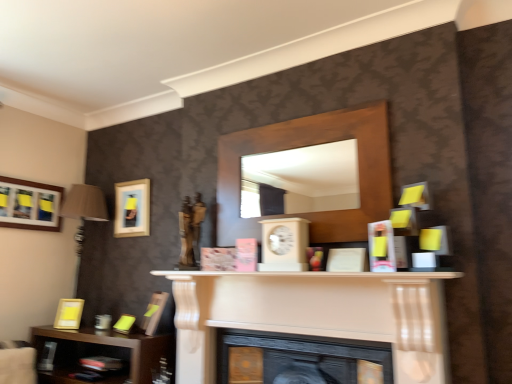
Image resolution: width=512 pixels, height=384 pixels. What do you see at coordinates (154, 312) in the screenshot?
I see `matte gold picture frame at lower left, the 4th picture frame when ordered from left to right` at bounding box center [154, 312].

This screenshot has width=512, height=384. Describe the element at coordinates (306, 146) in the screenshot. I see `wooden mirror at center, which is the 1th shelf from top to bottom` at that location.

In order to face wooden mirror at center, the 1th shelf viewed from the right, should I rotate leftwards or rightwards?

Turn right by 5.217 degrees to look at wooden mirror at center, the 1th shelf viewed from the right.

Describe the element at coordinates (29, 205) in the screenshot. I see `wooden picture frame at upper left, which appears as the 4th picture frame when viewed from the right` at that location.

The width and height of the screenshot is (512, 384). Describe the element at coordinates (304, 353) in the screenshot. I see `black matte fireplace at center, which appears as the first fireplace when ordered from the bottom` at that location.

At what (x,y) coordinates should I click in order to perform the action: click on black matte fireplace at center, which appears as the first fireplace when ordered from the bottom. Please return your answer as a coordinate pair (x, y). Looking at the image, I should click on (304, 353).

The image size is (512, 384). Find the location of `matte yellow picture frame at lower left, the third picture frame when ordered from right to left`. matte yellow picture frame at lower left, the third picture frame when ordered from right to left is located at coordinates (69, 314).

The height and width of the screenshot is (384, 512). In order to click on matte gold picture frame at lower left, arranged as the 1th picture frame when viewed from the right in this screenshot , I will do `click(154, 312)`.

Is the position of matte black picture frame at upper left, the 2th picture frame positioned from the right, less distant than that of wooden picture frame at upper left, marked as the first picture frame in a left-to-right arrangement?

No.

Looking at this image, does matte black picture frame at upper left, which is the third picture frame in left-to-right order, have a smaller size compared to wooden picture frame at upper left, marked as the first picture frame in a left-to-right arrangement?

Incorrect, matte black picture frame at upper left, which is the third picture frame in left-to-right order, is not smaller in size than wooden picture frame at upper left, marked as the first picture frame in a left-to-right arrangement.

Which of these two, matte black picture frame at upper left, which is the third picture frame in left-to-right order, or wooden picture frame at upper left, which appears as the 4th picture frame when viewed from the right, stands shorter?

With less height is wooden picture frame at upper left, which appears as the 4th picture frame when viewed from the right.

Could you measure the distance between matte black picture frame at upper left, which is the third picture frame in left-to-right order, and wooden picture frame at upper left, which appears as the 4th picture frame when viewed from the right?

A distance of 56.46 centimeters exists between matte black picture frame at upper left, which is the third picture frame in left-to-right order, and wooden picture frame at upper left, which appears as the 4th picture frame when viewed from the right.

Which object is positioned more to the left, matte gold picture frame at lower left, arranged as the 1th picture frame when viewed from the right, or matte yellow picture frame at lower left, which is counted as the 2th picture frame, starting from the left?

From the viewer's perspective, matte yellow picture frame at lower left, which is counted as the 2th picture frame, starting from the left, appears more on the left side.

Is matte gold picture frame at lower left, arranged as the 1th picture frame when viewed from the right, not inside matte yellow picture frame at lower left, the third picture frame when ordered from right to left?

Yes, matte gold picture frame at lower left, arranged as the 1th picture frame when viewed from the right, is not within matte yellow picture frame at lower left, the third picture frame when ordered from right to left.

From the image's perspective, is matte gold picture frame at lower left, arranged as the 1th picture frame when viewed from the right, on top of matte yellow picture frame at lower left, the third picture frame when ordered from right to left?

Yes, from the image's perspective, matte gold picture frame at lower left, arranged as the 1th picture frame when viewed from the right, is over matte yellow picture frame at lower left, the third picture frame when ordered from right to left.

Is matte gold picture frame at lower left, the 4th picture frame when ordered from left to right, positioned far away from matte yellow picture frame at lower left, which is counted as the 2th picture frame, starting from the left?

No, matte gold picture frame at lower left, the 4th picture frame when ordered from left to right, is in close proximity to matte yellow picture frame at lower left, which is counted as the 2th picture frame, starting from the left.

Is wooden clock at center closer to camera compared to matte gold picture frame at lower left, arranged as the 1th picture frame when viewed from the right?

That is True.

From the image's perspective, is wooden clock at center on top of matte gold picture frame at lower left, the 4th picture frame when ordered from left to right?

Correct, wooden clock at center appears higher than matte gold picture frame at lower left, the 4th picture frame when ordered from left to right, in the image.

Is wooden clock at center oriented towards matte gold picture frame at lower left, the 4th picture frame when ordered from left to right?

No, wooden clock at center is not turned towards matte gold picture frame at lower left, the 4th picture frame when ordered from left to right.

Does wooden clock at center have a greater height compared to matte gold picture frame at lower left, arranged as the 1th picture frame when viewed from the right?

In fact, wooden clock at center may be shorter than matte gold picture frame at lower left, arranged as the 1th picture frame when viewed from the right.

Is wooden mirror at center, the 1th shelf viewed from the right, in front of or behind wooden picture frame at upper left, marked as the first picture frame in a left-to-right arrangement, in the image?

Clearly, wooden mirror at center, the 1th shelf viewed from the right, is in front of wooden picture frame at upper left, marked as the first picture frame in a left-to-right arrangement.

Is point (223, 165) in front of point (50, 208)?

Yes, point (223, 165) is in front of point (50, 208).

Is wooden picture frame at upper left, which appears as the 4th picture frame when viewed from the right, at the back of wooden mirror at center, the 1th shelf viewed from the right?

No, wooden picture frame at upper left, which appears as the 4th picture frame when viewed from the right, is not at the back of wooden mirror at center, the 1th shelf viewed from the right.

From the image's perspective, is wooden mirror at center, the 1th shelf viewed from the right, located beneath wooden picture frame at upper left, marked as the first picture frame in a left-to-right arrangement?

No.

Does wooden picture frame at upper left, which appears as the 4th picture frame when viewed from the right, have a smaller size compared to wooden clock at center?

Yes, wooden picture frame at upper left, which appears as the 4th picture frame when viewed from the right, is smaller than wooden clock at center.

Which object is wider, wooden picture frame at upper left, marked as the first picture frame in a left-to-right arrangement, or wooden clock at center?

wooden clock at center.

How distant is wooden picture frame at upper left, marked as the first picture frame in a left-to-right arrangement, from wooden clock at center?

A distance of 1.74 meters exists between wooden picture frame at upper left, marked as the first picture frame in a left-to-right arrangement, and wooden clock at center.

Which is in front, point (21, 217) or point (279, 227)?

The point (279, 227) is in front.

From the image's perspective, is brown wooden shelf at lower left, which ranks as the second shelf in top-to-bottom order, positioned above or below white matte fireplace at center, placed as the second fireplace when sorted from bottom to top?

Clearly, from the image's perspective, brown wooden shelf at lower left, which ranks as the second shelf in top-to-bottom order, is below white matte fireplace at center, placed as the second fireplace when sorted from bottom to top.

From a real-world perspective, which object stands above the other?

white matte fireplace at center, arranged as the 1th fireplace when viewed from the top.

There is a brown wooden shelf at lower left, marked as the first shelf in a bottom-to-top arrangement. Where is `the 2nd fireplace above it (from a real-world perspective)`? The width and height of the screenshot is (512, 384). the 2nd fireplace above it (from a real-world perspective) is located at coordinates (314, 314).

Does brown wooden shelf at lower left, which ranks as the second shelf in top-to-bottom order, have a smaller size compared to white matte fireplace at center, placed as the second fireplace when sorted from bottom to top?

Yes, brown wooden shelf at lower left, which ranks as the second shelf in top-to-bottom order, is smaller than white matte fireplace at center, placed as the second fireplace when sorted from bottom to top.

Is black matte fireplace at center, which appears as the first fireplace when ordered from the bottom, facing away from matte black picture frame at upper left, which is the third picture frame in left-to-right order?

No, black matte fireplace at center, which appears as the first fireplace when ordered from the bottom, is not facing away from matte black picture frame at upper left, which is the third picture frame in left-to-right order.

Looking at this image, from a real-world perspective, is black matte fireplace at center, which appears as the first fireplace when ordered from the bottom, above or below matte black picture frame at upper left, the 2th picture frame positioned from the right?

In terms of real-world spatial position, black matte fireplace at center, which appears as the first fireplace when ordered from the bottom, is below matte black picture frame at upper left, the 2th picture frame positioned from the right.

Which object is thinner, black matte fireplace at center, which appears as the first fireplace when ordered from the bottom, or matte black picture frame at upper left, which is the third picture frame in left-to-right order?

matte black picture frame at upper left, which is the third picture frame in left-to-right order.

You are a GUI agent. You are given a task and a screenshot of the screen. Output one action in this format:
    pyautogui.click(x=<x>, y=<y>)
    Task: Click on the picture frame that is the 2nd one when counting leftward from the matte black picture frame at upper left, the 2th picture frame positioned from the right
    The height and width of the screenshot is (384, 512).
    Given the screenshot: What is the action you would take?
    pyautogui.click(x=29, y=205)

Where is `picture frame below the matte gold picture frame at lower left, the 4th picture frame when ordered from left to right (from the image's perspective)`? This screenshot has width=512, height=384. picture frame below the matte gold picture frame at lower left, the 4th picture frame when ordered from left to right (from the image's perspective) is located at coordinates (69, 314).

From the image, which object appears to be farther from matte yellow picture frame at lower left, which is counted as the 2th picture frame, starting from the left, brown wooden shelf at lower left, marked as the first shelf in a bottom-to-top arrangement, or matte black picture frame at upper left, the 2th picture frame positioned from the right?

Based on the image, matte black picture frame at upper left, the 2th picture frame positioned from the right, appears to be further to matte yellow picture frame at lower left, which is counted as the 2th picture frame, starting from the left.

Estimate the real-world distances between objects in this image. Which object is further from matte gold picture frame at lower left, arranged as the 1th picture frame when viewed from the right, wooden picture frame at upper left, marked as the first picture frame in a left-to-right arrangement, or black matte fireplace at center, which appears as the first fireplace when ordered from the bottom?

wooden picture frame at upper left, marked as the first picture frame in a left-to-right arrangement.

Based on their spatial positions, is wooden picture frame at upper left, which appears as the 4th picture frame when viewed from the right, or wooden mirror at center, the 1th shelf viewed from the right, closer to wooden clock at center?

wooden mirror at center, the 1th shelf viewed from the right, is closer to wooden clock at center.

When comparing their distances from black matte fireplace at center, acting as the 2th fireplace starting from the top, does wooden mirror at center, marked as the 2th shelf in a left-to-right arrangement, or matte gold picture frame at lower left, the 4th picture frame when ordered from left to right, seem closer?

wooden mirror at center, marked as the 2th shelf in a left-to-right arrangement, is positioned closer to the anchor black matte fireplace at center, acting as the 2th fireplace starting from the top.

Based on their spatial positions, is brown wooden shelf at lower left, which is counted as the 2th shelf, starting from the right, or matte gold picture frame at lower left, the 4th picture frame when ordered from left to right, further from matte black picture frame at upper left, the 2th picture frame positioned from the right?

brown wooden shelf at lower left, which is counted as the 2th shelf, starting from the right, lies further to matte black picture frame at upper left, the 2th picture frame positioned from the right, than the other object.

Which object lies further to the anchor point matte black picture frame at upper left, the 2th picture frame positioned from the right, black matte fireplace at center, acting as the 2th fireplace starting from the top, or brown wooden shelf at lower left, marked as the first shelf in a bottom-to-top arrangement?

The object further to matte black picture frame at upper left, the 2th picture frame positioned from the right, is black matte fireplace at center, acting as the 2th fireplace starting from the top.

Based on the photo, based on their spatial positions, is white matte fireplace at center, arranged as the 1th fireplace when viewed from the top, or wooden mirror at center, which is the 1th shelf from top to bottom, closer to matte black picture frame at upper left, which is the third picture frame in left-to-right order?

wooden mirror at center, which is the 1th shelf from top to bottom, is positioned closer to the anchor matte black picture frame at upper left, which is the third picture frame in left-to-right order.

Considering their positions, is wooden mirror at center, which is the 1th shelf from top to bottom, positioned closer to brown wooden shelf at lower left, which is counted as the 2th shelf, starting from the right, than matte yellow picture frame at lower left, the third picture frame when ordered from right to left?

matte yellow picture frame at lower left, the third picture frame when ordered from right to left.

Identify the location of fireplace between matte yellow picture frame at lower left, which is counted as the 2th picture frame, starting from the left, and wooden mirror at center, which is the 1th shelf from top to bottom. This screenshot has width=512, height=384. (314, 314).

The height and width of the screenshot is (384, 512). Identify the location of fireplace between brown wooden shelf at lower left, marked as the first shelf in a bottom-to-top arrangement, and wooden clock at center from left to right. (314, 314).

This screenshot has width=512, height=384. I want to click on clock situated between matte gold picture frame at lower left, arranged as the 1th picture frame when viewed from the right, and wooden mirror at center, the 1th shelf viewed from the right, from left to right, so click(x=284, y=244).

This screenshot has height=384, width=512. What are the coordinates of `picture frame situated between matte black picture frame at upper left, which is the third picture frame in left-to-right order, and wooden mirror at center, which is the 1th shelf from top to bottom, from left to right` in the screenshot? It's located at (154, 312).